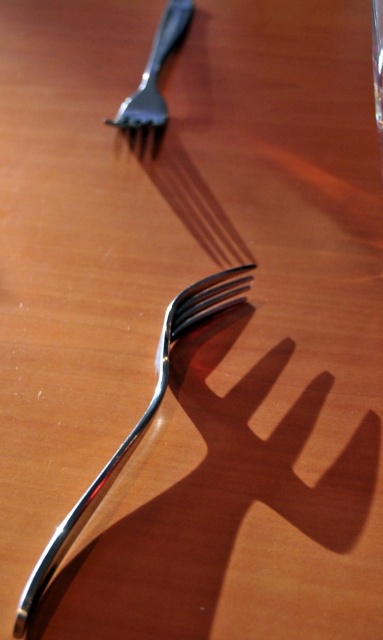
Can you confirm if polished metal fork at center is bigger than satin finish fork at upper left?

Yes.

Is point (13, 630) less distant than point (147, 124)?

Yes, it is.

Is point (247, 266) behind point (178, 3)?

No, it is in front of (178, 3).

Locate an element on the screen. Image resolution: width=383 pixels, height=640 pixels. polished metal fork at center is located at coordinates (137, 420).